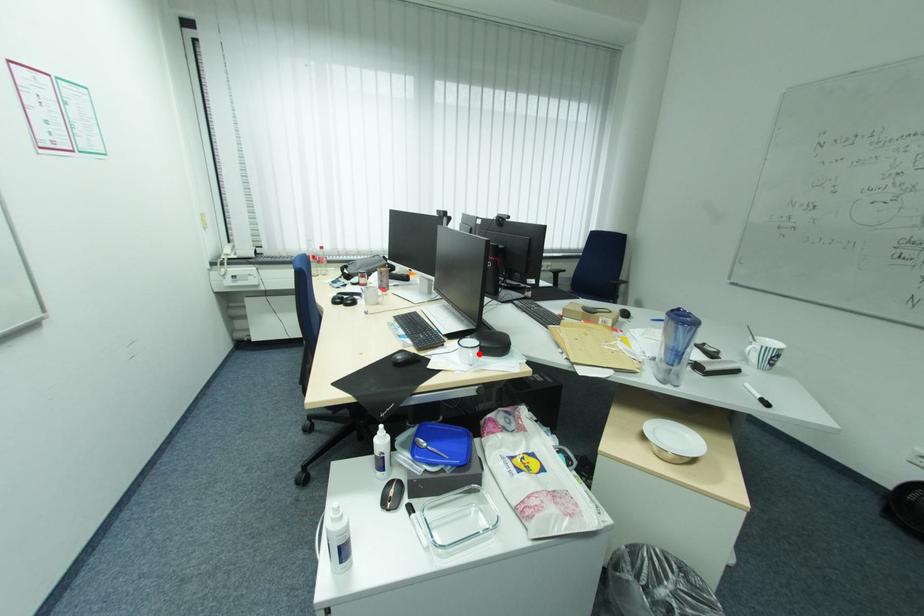
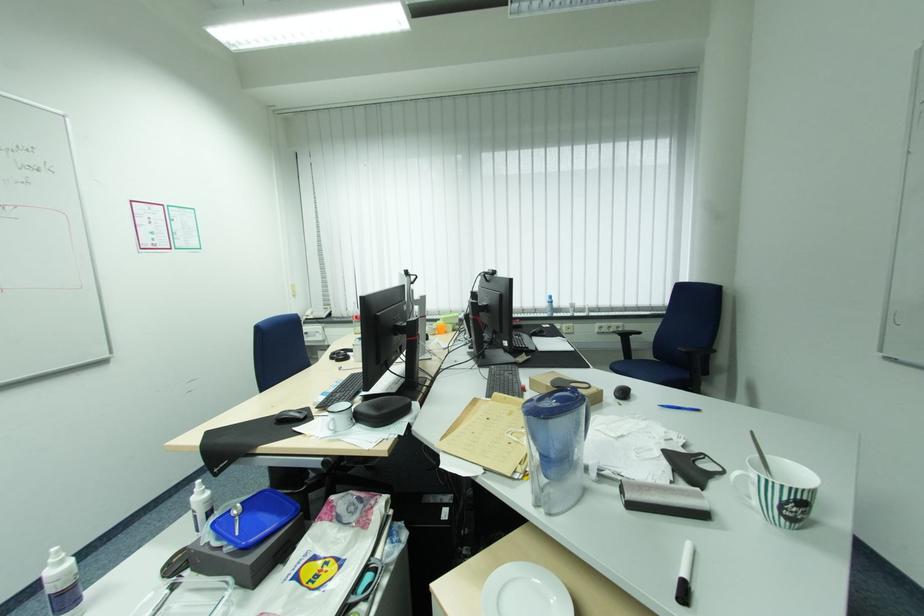
Locate, in the second image, the point that corresponds to the highlighted location in the first image.

(339, 419)